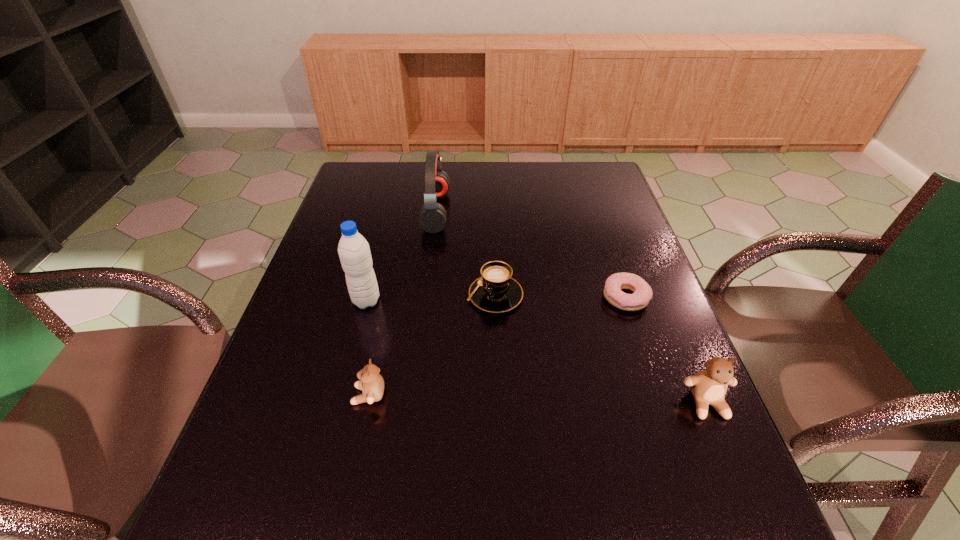
Where is `doughnut present at the right edge`? doughnut present at the right edge is located at coordinates (615, 283).

Where is `free region at the far edge of the desktop`? This screenshot has width=960, height=540. free region at the far edge of the desktop is located at coordinates (458, 197).

Locate an element on the screen. The width and height of the screenshot is (960, 540). vacant space at the near edge of the desktop is located at coordinates (332, 440).

The width and height of the screenshot is (960, 540). I want to click on vacant area at the left edge of the desktop, so click(x=308, y=388).

In the image, there is a desktop. Where is `free space at the right edge`? This screenshot has height=540, width=960. free space at the right edge is located at coordinates (586, 251).

Locate an element on the screen. The image size is (960, 540). free space at the far left corner is located at coordinates (382, 196).

This screenshot has height=540, width=960. In the image, there is a desktop. Find the location of `vacant space at the far right corner`. vacant space at the far right corner is located at coordinates (612, 183).

The height and width of the screenshot is (540, 960). In order to click on vacant region at the near right corner in this screenshot , I will do `click(728, 464)`.

Locate an element on the screen. free point between the shortest object and the fifth tallest object is located at coordinates (561, 296).

Where is `vacant area that lies between the cappuccino and the second tallest object`? The image size is (960, 540). vacant area that lies between the cappuccino and the second tallest object is located at coordinates (466, 253).